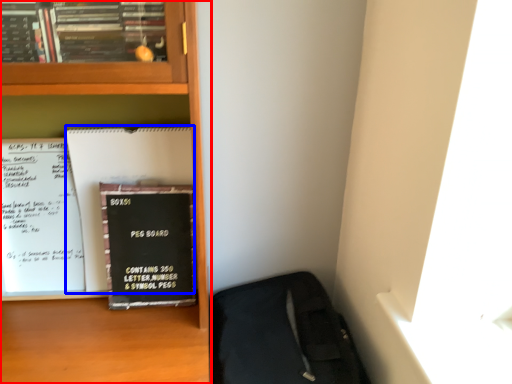
Question: Among these objects, which one is nearest to the camera, bookcase (highlighted by a red box) or paperback book (highlighted by a blue box)?

Choices:
 (A) bookcase
 (B) paperback book

Answer: (A)